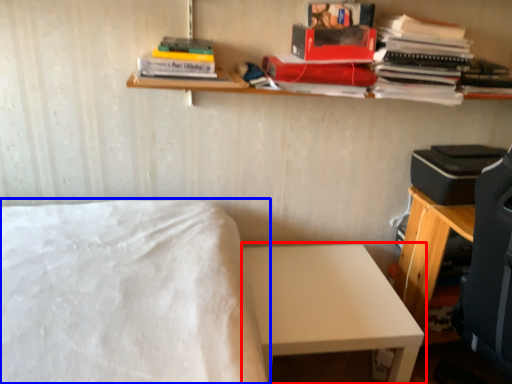
Question: Which object is further to the camera taking this photo, table (highlighted by a red box) or bed (highlighted by a blue box)?

Choices:
 (A) table
 (B) bed

Answer: (A)